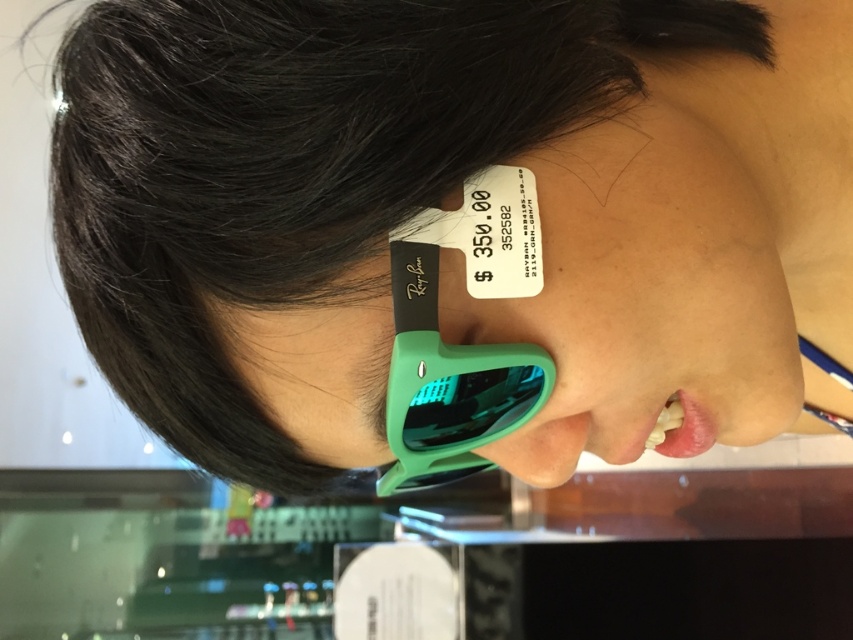
Question: Is black matte hair at upper left above green matte sunglasses at center?

Choices:
 (A) no
 (B) yes

Answer: (B)

Question: Which point appears closest to the camera in this image?

Choices:
 (A) (430, 468)
 (B) (273, 426)

Answer: (B)

Question: Which object is farther from the camera taking this photo?

Choices:
 (A) green matte sunglasses at center
 (B) black matte hair at upper left

Answer: (A)

Question: Does black matte hair at upper left appear on the right side of green matte sunglasses at center?

Choices:
 (A) no
 (B) yes

Answer: (A)

Question: In this image, where is black matte hair at upper left located relative to green matte sunglasses at center?

Choices:
 (A) right
 (B) left

Answer: (B)